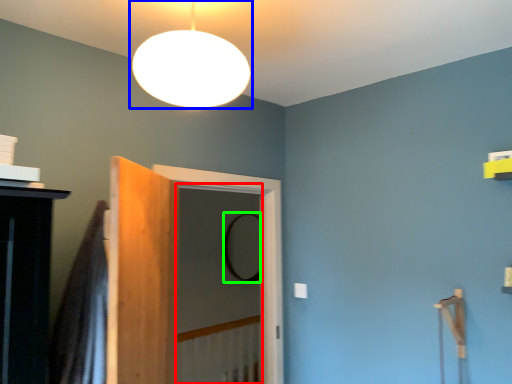
Question: Considering the real-world distances, which object is farthest from screen door (highlighted by a red box)? lamp (highlighted by a blue box) or mirror (highlighted by a green box)?

Choices:
 (A) lamp
 (B) mirror

Answer: (A)